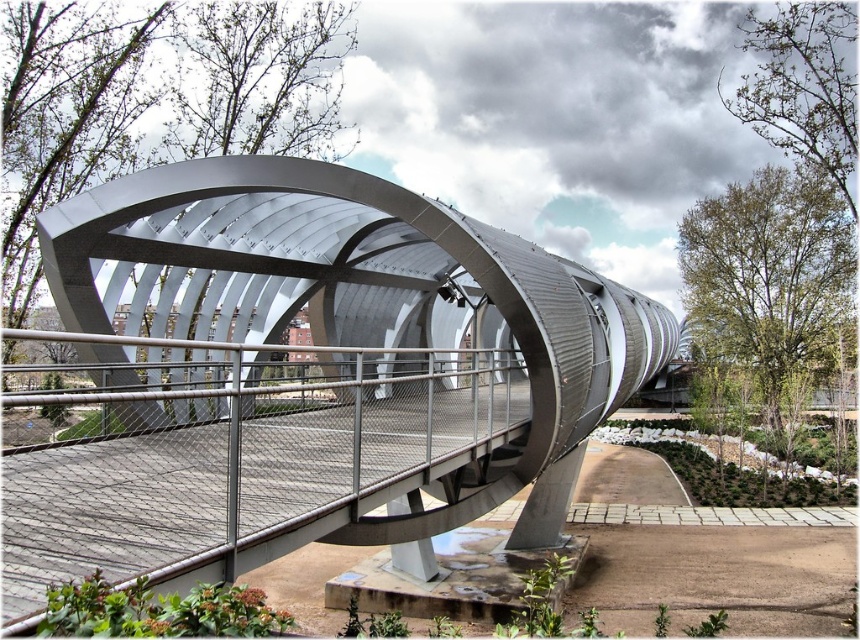
Question: Does polished steel bridge at center lie behind metal mesh railing at center?

Choices:
 (A) yes
 (B) no

Answer: (A)

Question: Observing the image, what is the correct spatial positioning of polished steel bridge at center in reference to metal mesh railing at center?

Choices:
 (A) below
 (B) above

Answer: (B)

Question: Is polished steel bridge at center in front of metal mesh railing at center?

Choices:
 (A) yes
 (B) no

Answer: (B)

Question: Among these objects, which one is nearest to the camera?

Choices:
 (A) metal mesh railing at center
 (B) polished steel bridge at center

Answer: (A)